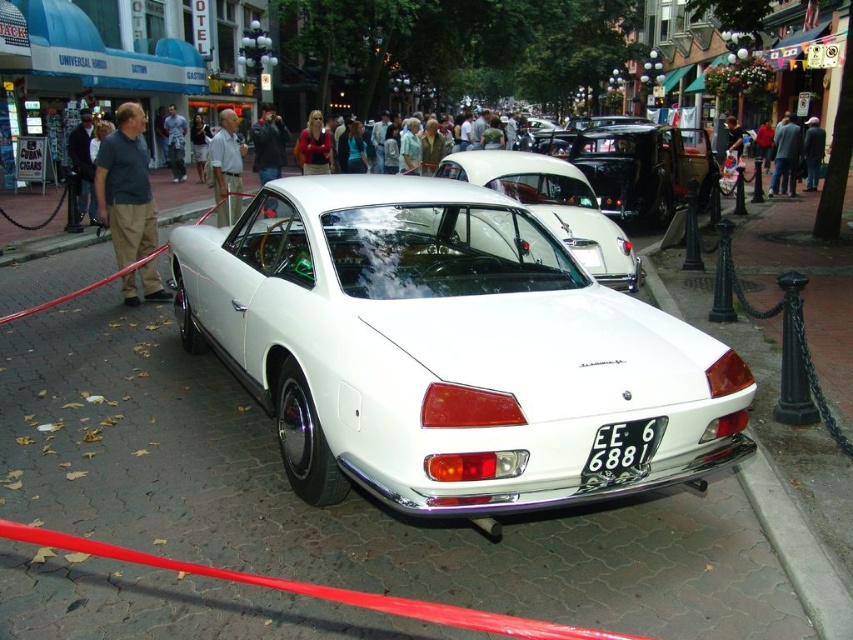
You are a photographer planning to take a photo of the white glossy car at center. Since you want to ensure the entire car fits in the frame, you need to know if the white smooth pavement at center can accommodate the car. Can it?

The white smooth pavement at center is larger in size than the white glossy car at center, so yes, the pavement can accommodate the entire car.